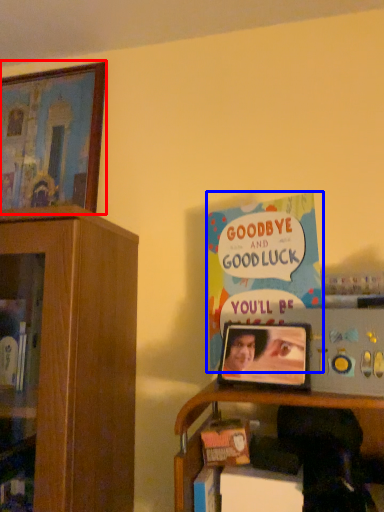
Question: Which object appears closest to the camera in this image, picture frame (highlighted by a red box) or book (highlighted by a blue box)?

Choices:
 (A) picture frame
 (B) book

Answer: (B)